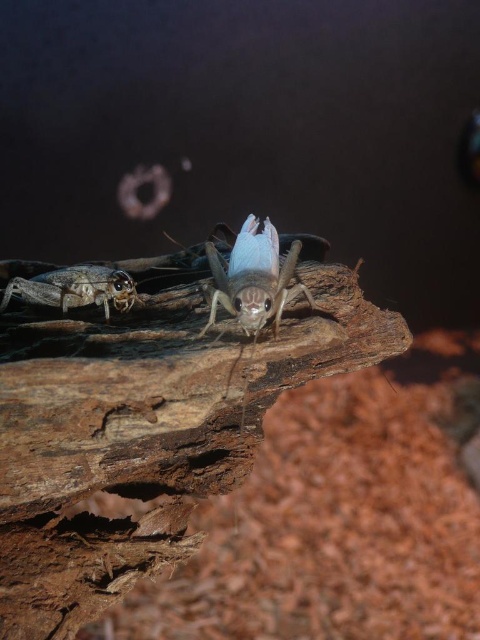
Question: Can you confirm if translucent blue wings at center is wider than translucent brown cricket at lower left?

Choices:
 (A) no
 (B) yes

Answer: (A)

Question: Is brown rough wood at center to the left of translucent brown cricket at lower left from the viewer's perspective?

Choices:
 (A) yes
 (B) no

Answer: (B)

Question: Estimate the real-world distances between objects in this image. Which object is closer to the translucent blue wings at center?

Choices:
 (A) brown rough wood at center
 (B) translucent brown cricket at lower left

Answer: (A)

Question: Which of the following is the closest to the observer?

Choices:
 (A) translucent brown cricket at lower left
 (B) brown rough wood at center

Answer: (B)

Question: Is translucent blue wings at center further to the viewer compared to translucent brown cricket at lower left?

Choices:
 (A) yes
 (B) no

Answer: (B)

Question: Which point appears farthest from the camera in this image?

Choices:
 (A) (216, 282)
 (B) (170, 436)
 (C) (36, 291)

Answer: (C)